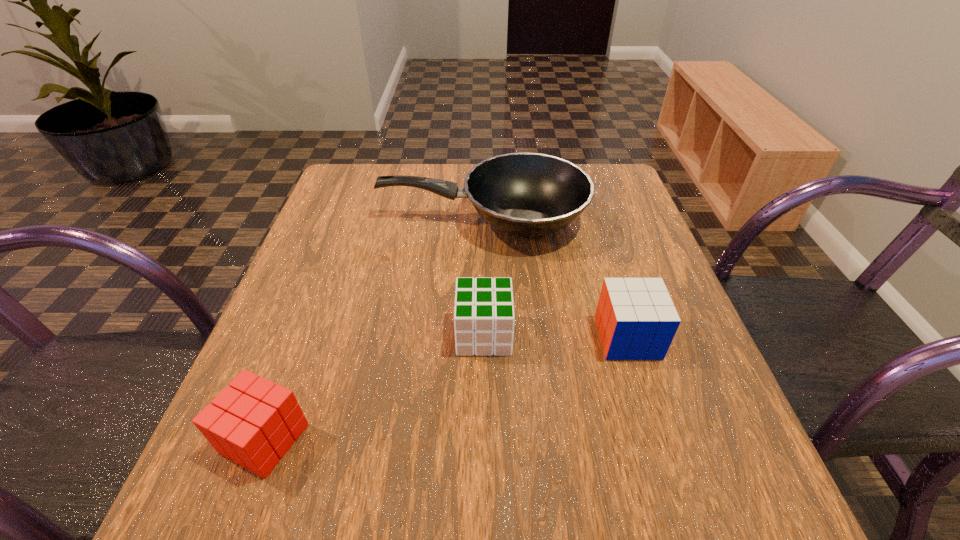
Locate an element on the screen. The image size is (960, 540). frying pan is located at coordinates (524, 194).

You are a GUI agent. You are given a task and a screenshot of the screen. Output one action in this format:
    pyautogui.click(x=<x>, y=<y>)
    Task: Click on the rightmost cube
    This screenshot has height=540, width=960.
    Given the screenshot: What is the action you would take?
    pyautogui.click(x=636, y=319)

Where is `the second cube from right to left`? The height and width of the screenshot is (540, 960). the second cube from right to left is located at coordinates (484, 317).

You are a GUI agent. You are given a task and a screenshot of the screen. Output one action in this format:
    pyautogui.click(x=<x>, y=<y>)
    Task: Click on the nearest cube
    The image size is (960, 540).
    Given the screenshot: What is the action you would take?
    pyautogui.click(x=254, y=422)

Where is `the leftmost object`? This screenshot has width=960, height=540. the leftmost object is located at coordinates (254, 422).

Find the location of a particular element. This screenshot has width=960, height=540. free space located on the back of the farthest object is located at coordinates (482, 171).

I want to click on vacant space positioned on the back of the rightmost cube, so click(x=610, y=280).

Where is `vacant space situated on the red face of the second cube from left to right`? This screenshot has width=960, height=540. vacant space situated on the red face of the second cube from left to right is located at coordinates (345, 334).

What are the coordinates of `free space located 0.250m on the red face of the second cube from left to right` in the screenshot? It's located at (317, 334).

Where is `free space located on the red face of the second cube from left to right`? The width and height of the screenshot is (960, 540). free space located on the red face of the second cube from left to right is located at coordinates (283, 334).